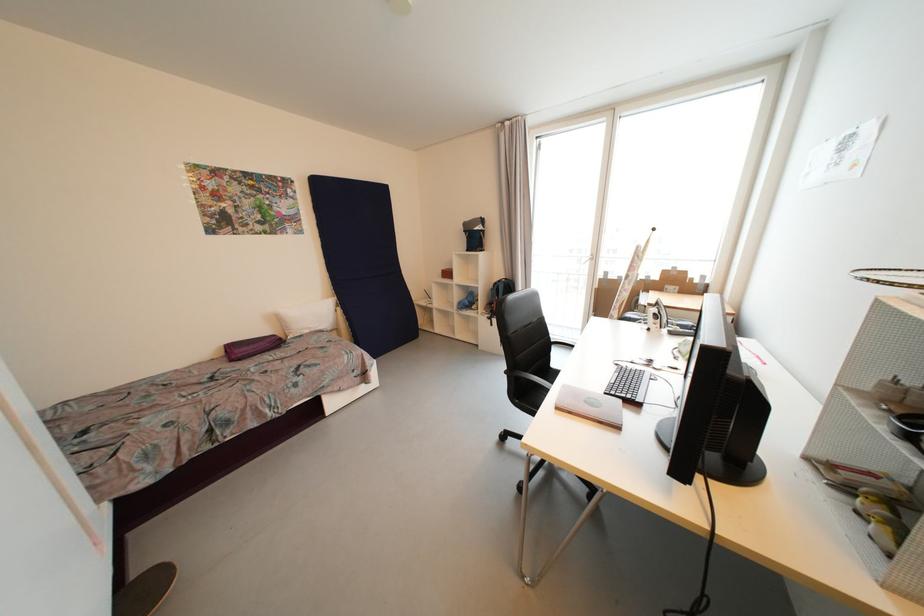
I want to click on chair armrest, so click(529, 378).